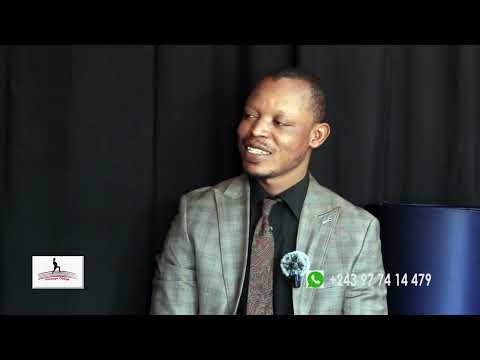
Locate an element on the screen. black curtain is located at coordinates (128, 114).